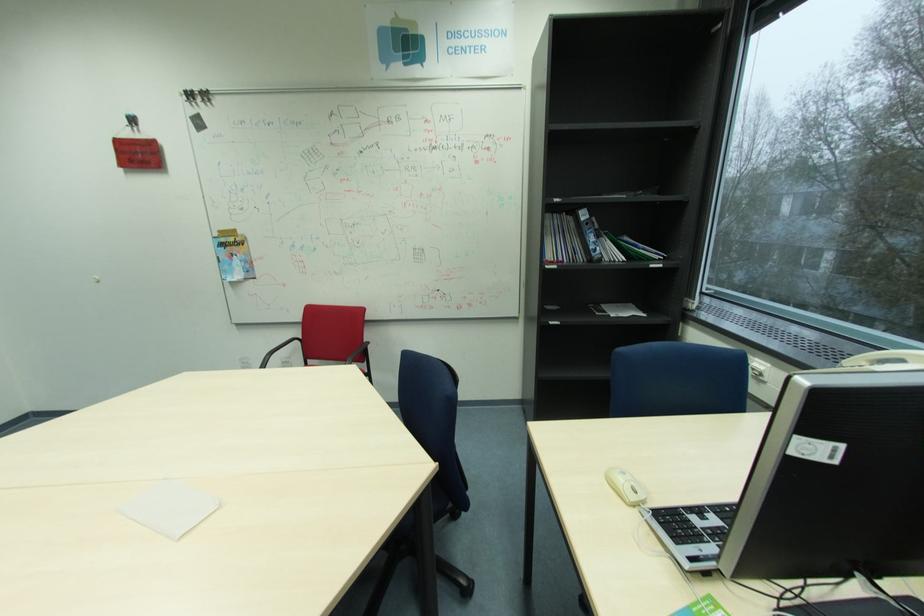
The height and width of the screenshot is (616, 924). Find the location of `black chair armrest`. black chair armrest is located at coordinates click(x=358, y=353).